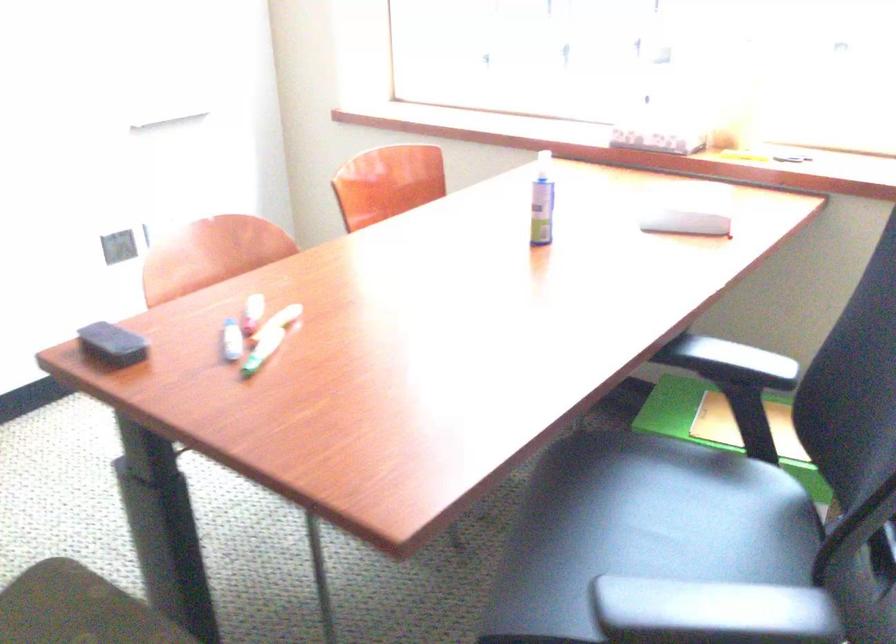
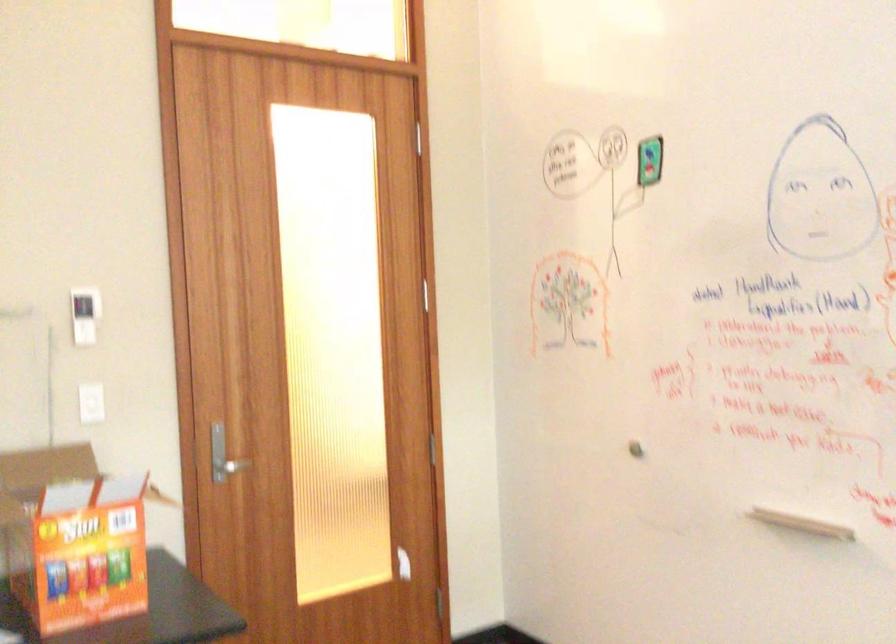
Question: How did the camera likely rotate?

Choices:
 (A) Left
 (B) Right
 (C) Up
 (D) Down

Answer: (A)